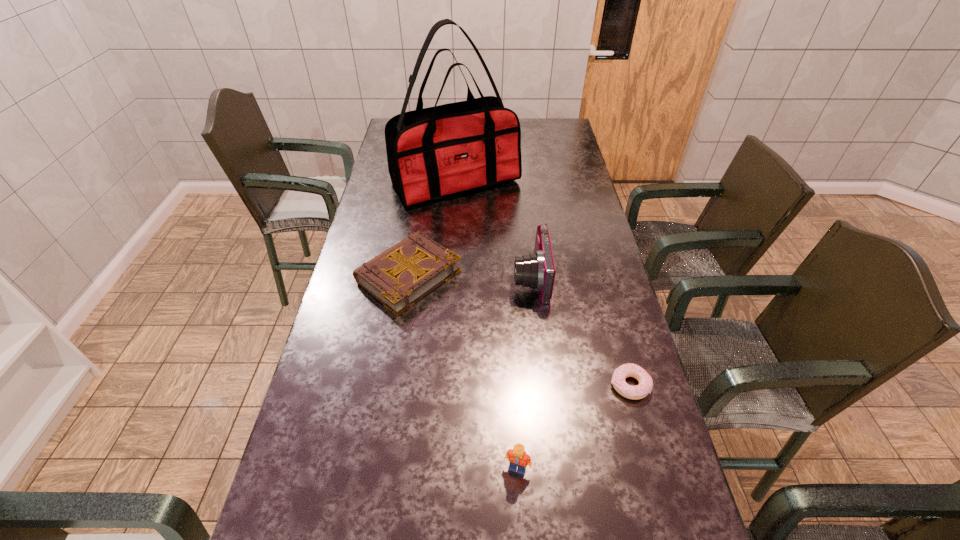
Image resolution: width=960 pixels, height=540 pixels. What are the coordinates of `free spot located on the front-facing side of the camera` in the screenshot? It's located at (437, 279).

The width and height of the screenshot is (960, 540). In order to click on vacant region located 0.190m on the front-facing side of the camera in this screenshot , I will do `click(452, 279)`.

The width and height of the screenshot is (960, 540). Identify the location of vacant region located on the right of the second shortest object. (527, 276).

At what (x,y) coordinates should I click in order to perform the action: click on free space located 0.130m on the left of the doughnut. Please return your answer as a coordinate pair (x, y). The height and width of the screenshot is (540, 960). Looking at the image, I should click on tap(559, 385).

You are a GUI agent. You are given a task and a screenshot of the screen. Output one action in this format:
    pyautogui.click(x=<x>, y=<y>)
    Task: Click on the duffel bag that is at the left edge
    The image size is (960, 540).
    Given the screenshot: What is the action you would take?
    pyautogui.click(x=433, y=153)

This screenshot has width=960, height=540. What are the coordinates of `hardback book present at the left edge` in the screenshot? It's located at (x=399, y=277).

Where is `object positioned at the right edge`? object positioned at the right edge is located at coordinates (644, 388).

Identify the location of free location at the left edge. (390, 213).

I want to click on vacant area at the right edge of the desktop, so click(x=593, y=397).

This screenshot has width=960, height=540. I want to click on vacant space at the far right corner, so click(x=560, y=121).